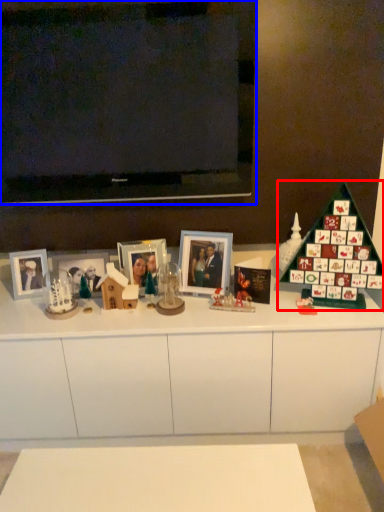
Question: Which point is closer to the camera, christmas tree (highlighted by a red box) or television (highlighted by a blue box)?

Choices:
 (A) christmas tree
 (B) television

Answer: (A)